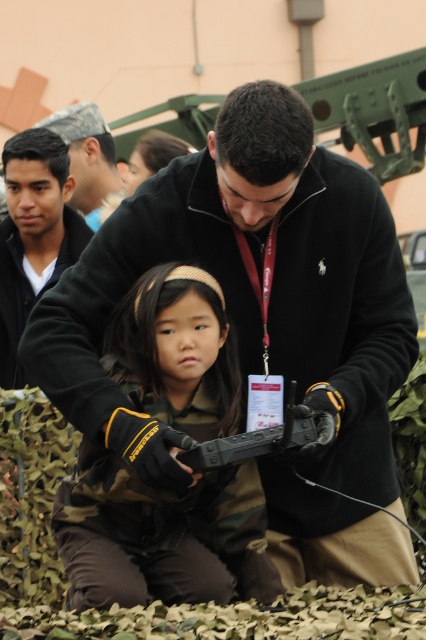
Does point (14, 188) lie in front of point (195, 461)?

No, it is not.

This screenshot has width=426, height=640. I want to click on matte black jacket at upper left, so click(34, 236).

The image size is (426, 640). In order to click on matte black jacket at upper left in this screenshot , I will do `click(34, 236)`.

Which of these two, camouflage fabric at center or black rubber gun at center, stands taller?

camouflage fabric at center

Who is more distant from viewer, (229,522) or (299,417)?

The point (229,522) is behind.

This screenshot has width=426, height=640. I want to click on camouflage fabric at center, so click(161, 536).

At what (x,y) coordinates should I click in order to perform the action: click on camouflage fabric at center. Please return your answer as a coordinate pair (x, y). Looking at the image, I should click on (161, 536).

Is point (155, 378) closer to camera compared to point (40, 248)?

Yes, it is in front of point (40, 248).

Based on the photo, is camouflage fabric at center to the right of matte black jacket at upper left from the viewer's perspective?

Correct, you'll find camouflage fabric at center to the right of matte black jacket at upper left.

Is point (164, 356) farther from camera compared to point (60, 205)?

No.

At what (x,y) coordinates should I click in order to perform the action: click on camouflage fabric at center. Please return your answer as a coordinate pair (x, y). The image size is (426, 640). Looking at the image, I should click on (161, 536).